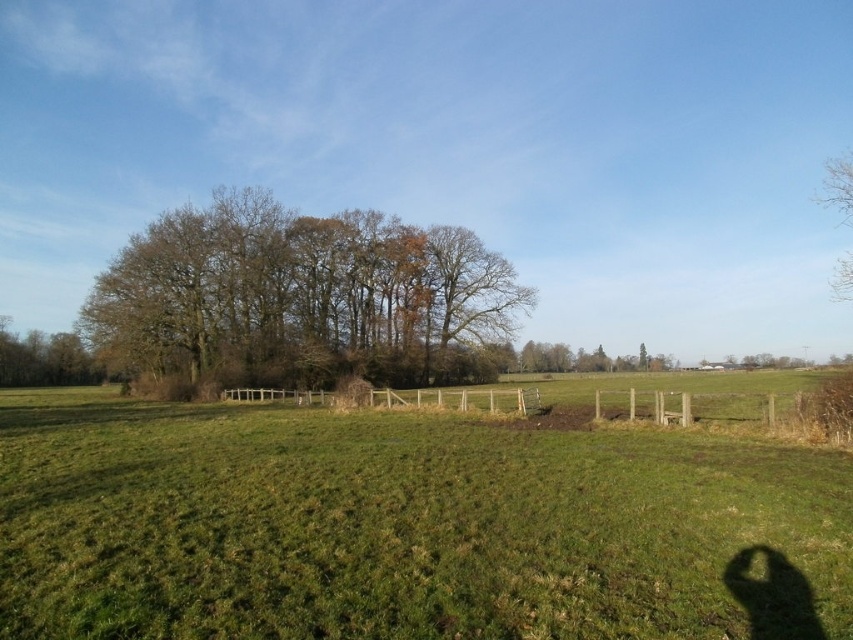
You are standing in the field and want to walk towards the trees. Which tree, the brown leafy tree at center or the brown textured tree at left, will you reach first?

The brown leafy tree at center is closer to the viewer than the brown textured tree at left, so you will reach the brown leafy tree at center first.

You are standing in the middle of the field and want to walk towards the brown leafy tree at center. Which direction should you walk to avoid the bare branches at upper right?

You should walk to the left because the brown leafy tree at center is to the left of the bare branches at upper right, so moving left will take you toward the tree while avoiding the branches.

You are standing at the point with coordinates (300,298) in the image. What object are you facing in the rural landscape scene?

The point at coordinates (300,298) corresponds to the brown leafy tree at center, so you are facing the brown leafy tree at center in the rural landscape scene.